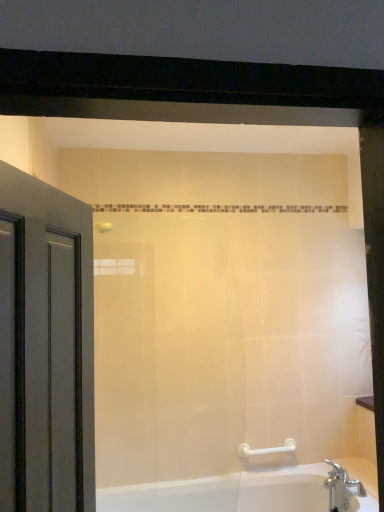
This screenshot has height=512, width=384. Describe the element at coordinates (266, 449) in the screenshot. I see `white plastic grab bar at lower right` at that location.

This screenshot has height=512, width=384. Describe the element at coordinates (227, 492) in the screenshot. I see `white glossy bathtub at lower right` at that location.

Identify the location of white plastic grab bar at lower right. Image resolution: width=384 pixels, height=512 pixels. (266, 449).

Do you think white glossy bathtub at lower right is within white plastic grab bar at lower right, or outside of it?

white glossy bathtub at lower right is located beyond the bounds of white plastic grab bar at lower right.

Is white glossy bathtub at lower right oriented away from white plastic grab bar at lower right?

white glossy bathtub at lower right does not have its back to white plastic grab bar at lower right.

From a real-world perspective, is white glossy bathtub at lower right positioned over white plastic grab bar at lower right based on gravity?

No, from a real-world perspective, white glossy bathtub at lower right is not on top of white plastic grab bar at lower right.

Which object is closer to the camera taking this photo, white glossy bathtub at lower right or white plastic grab bar at lower right?

white glossy bathtub at lower right.

Is white glossy bathtub at lower right beside matte gray door at left?

white glossy bathtub at lower right and matte gray door at left are clearly separated.

Which is behind, white glossy bathtub at lower right or matte gray door at left?

white glossy bathtub at lower right.

Is white glossy bathtub at lower right oriented away from matte gray door at left?

That's not correct — white glossy bathtub at lower right is not looking away from matte gray door at left.

From the image's perspective, would you say white plastic grab bar at lower right is shown under matte gray door at left?

Indeed, from the image's perspective, white plastic grab bar at lower right is shown beneath matte gray door at left.

From the picture: Visually, is white plastic grab bar at lower right positioned to the left or to the right of matte gray door at left?

white plastic grab bar at lower right is to the right of matte gray door at left.

Is white plastic grab bar at lower right located outside matte gray door at left?

That's correct, white plastic grab bar at lower right is outside of matte gray door at left.

Find the location of `door located on the left of white plastic grab bar at lower right`. door located on the left of white plastic grab bar at lower right is located at coordinates (45, 348).

Does matte gray door at left lie in front of white glossy bathtub at lower right?

Yes, matte gray door at left is in front of white glossy bathtub at lower right.

What's the angular difference between matte gray door at left and white glossy bathtub at lower right's facing directions?

71.8 degrees separate the facing orientations of matte gray door at left and white glossy bathtub at lower right.

Considering the relative sizes of matte gray door at left and white glossy bathtub at lower right in the image provided, is matte gray door at left smaller than white glossy bathtub at lower right?

Yes.

Between matte gray door at left and white glossy bathtub at lower right, which one has larger width?

With larger width is white glossy bathtub at lower right.

Considering the relative sizes of matte gray door at left and white plastic grab bar at lower right in the image provided, is matte gray door at left bigger than white plastic grab bar at lower right?

Yes.

Can you confirm if matte gray door at left is positioned to the left of white plastic grab bar at lower right?

Indeed, matte gray door at left is positioned on the left side of white plastic grab bar at lower right.

Considering the positions of points (20, 469) and (291, 439), is point (20, 469) closer to camera compared to point (291, 439)?

Yes, it is in front of point (291, 439).

Would you consider white plastic grab bar at lower right to be distant from white glossy bathtub at lower right?

No, there isn't a large distance between white plastic grab bar at lower right and white glossy bathtub at lower right.

From a real-world perspective, is white plastic grab bar at lower right located beneath white glossy bathtub at lower right?

No.

Who is more distant, white plastic grab bar at lower right or white glossy bathtub at lower right?

Positioned behind is white plastic grab bar at lower right.

Considering the relative positions of white plastic grab bar at lower right and white glossy bathtub at lower right in the image provided, is white plastic grab bar at lower right to the left or to the right of white glossy bathtub at lower right?

white plastic grab bar at lower right is to the right of white glossy bathtub at lower right.

From a real-world perspective, does matte gray door at left sit lower than chrome metallic faucet at lower right?

No, from a real-world perspective, matte gray door at left is not under chrome metallic faucet at lower right.

Is matte gray door at left at the right side of chrome metallic faucet at lower right?

In fact, matte gray door at left is to the left of chrome metallic faucet at lower right.

Is matte gray door at left taller than chrome metallic faucet at lower right?

Correct, matte gray door at left is much taller as chrome metallic faucet at lower right.

Is matte gray door at left beside chrome metallic faucet at lower right?

No, matte gray door at left is not in contact with chrome metallic faucet at lower right.

This screenshot has width=384, height=512. I want to click on bathtub that is under the white plastic grab bar at lower right (from a real-world perspective), so click(227, 492).

Where is `door in front of the white glossy bathtub at lower right`? This screenshot has height=512, width=384. door in front of the white glossy bathtub at lower right is located at coordinates (45, 348).

When comparing their distances from white glossy bathtub at lower right, does matte gray door at left or white plastic grab bar at lower right seem closer?

white plastic grab bar at lower right is closer to white glossy bathtub at lower right.

Considering their positions, is white glossy bathtub at lower right positioned closer to matte gray door at left than white plastic grab bar at lower right?

The object closer to matte gray door at left is white glossy bathtub at lower right.

Estimate the real-world distances between objects in this image. Which object is further from chrome metallic faucet at lower right, white glossy bathtub at lower right or white plastic grab bar at lower right?

Among the two, white plastic grab bar at lower right is located further to chrome metallic faucet at lower right.

Looking at the image, which one is located closer to white glossy bathtub at lower right, matte gray door at left or chrome metallic faucet at lower right?

Among the two, chrome metallic faucet at lower right is located nearer to white glossy bathtub at lower right.

Looking at the image, which one is located closer to matte gray door at left, white plastic grab bar at lower right or white glossy bathtub at lower right?

white glossy bathtub at lower right lies closer to matte gray door at left than the other object.

Estimate the real-world distances between objects in this image. Which object is closer to chrome metallic faucet at lower right, white glossy bathtub at lower right or matte gray door at left?

white glossy bathtub at lower right lies closer to chrome metallic faucet at lower right than the other object.

Estimate the real-world distances between objects in this image. Which object is further from white plastic grab bar at lower right, chrome metallic faucet at lower right or white glossy bathtub at lower right?

Based on the image, chrome metallic faucet at lower right appears to be further to white plastic grab bar at lower right.

Based on the photo, looking at the image, which one is located closer to white plastic grab bar at lower right, matte gray door at left or chrome metallic faucet at lower right?

Among the two, chrome metallic faucet at lower right is located nearer to white plastic grab bar at lower right.

The image size is (384, 512). In order to click on bathtub between matte gray door at left and chrome metallic faucet at lower right from front to back in this screenshot , I will do `click(227, 492)`.

Find the location of a particular element. This screenshot has height=512, width=384. bathtub located between matte gray door at left and white plastic grab bar at lower right in the depth direction is located at coordinates (227, 492).

Identify the location of tap located between white glossy bathtub at lower right and white plastic grab bar at lower right in the depth direction. (341, 487).

This screenshot has height=512, width=384. I want to click on tap between matte gray door at left and white plastic grab bar at lower right in the front-back direction, so click(341, 487).